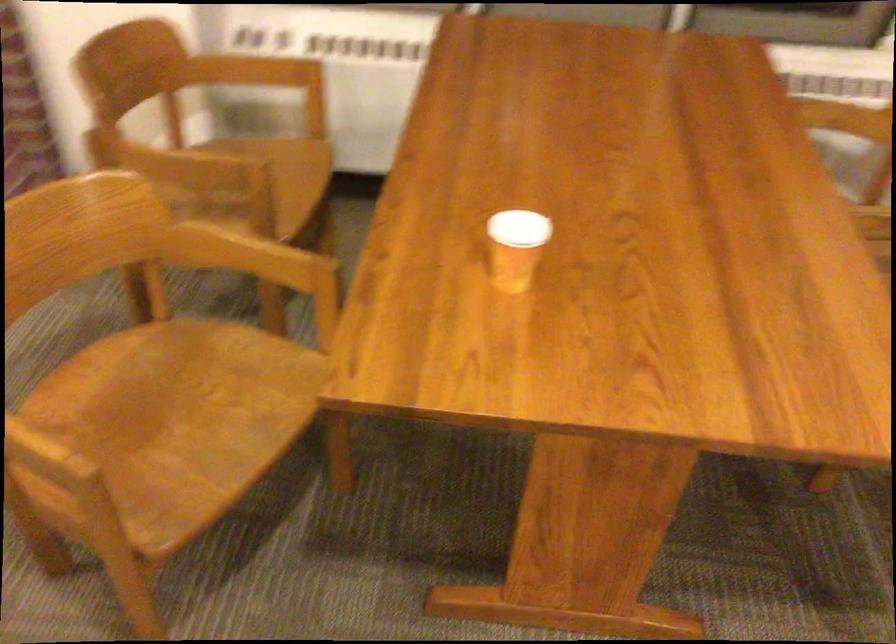
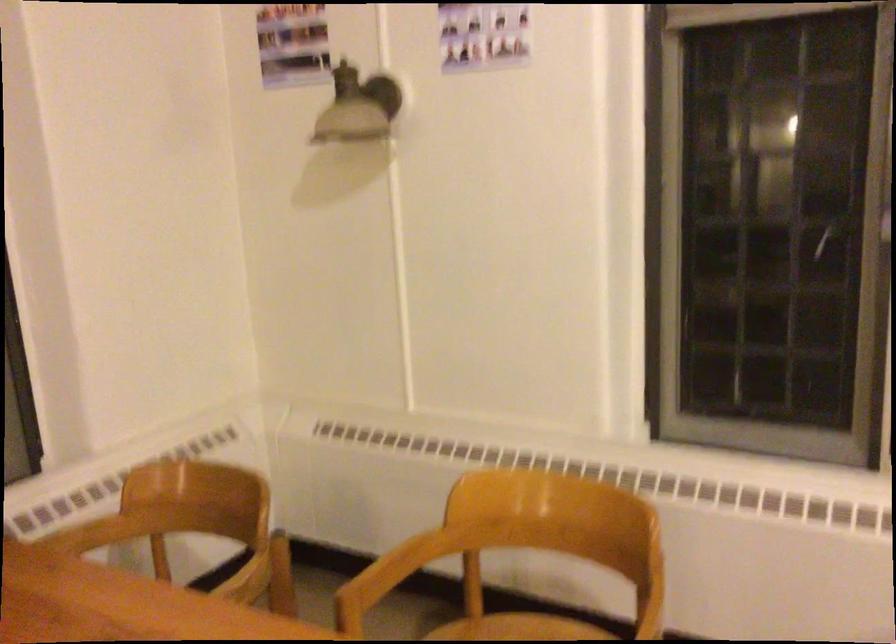
Question: The images are taken continuously from a first-person perspective. In which direction is your viewpoint rotating?

Choices:
 (A) Left
 (B) Right
 (C) Up
 (D) Down

Answer: (B)